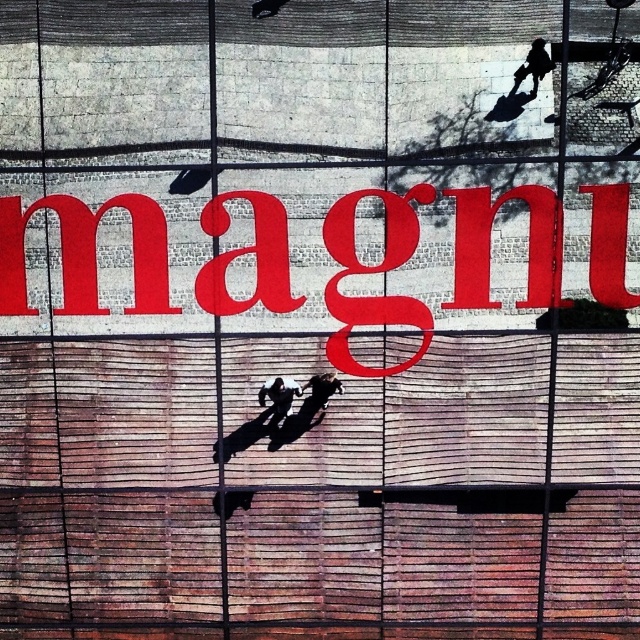
Question: Is red matte sign at center positioned in front of black matte skateboard at center?

Choices:
 (A) yes
 (B) no

Answer: (A)

Question: Is red matte sign at center below shiny black skateboard at upper right?

Choices:
 (A) no
 (B) yes

Answer: (B)

Question: Among these points, which one is nearest to the camera?

Choices:
 (A) (340, 260)
 (B) (529, 99)
 (C) (515, 81)

Answer: (C)

Question: Which of the following is the farthest from the observer?

Choices:
 (A) red matte sign at center
 (B) black matte skateboard at center

Answer: (B)

Question: Which point is closer to the camera?

Choices:
 (A) smooth black suit at upper right
 (B) shiny black skateboard at upper right
 (C) black matte skateboard at center

Answer: (A)

Question: Does red matte sign at center have a lesser width compared to shiny black skateboard at upper right?

Choices:
 (A) yes
 (B) no

Answer: (B)